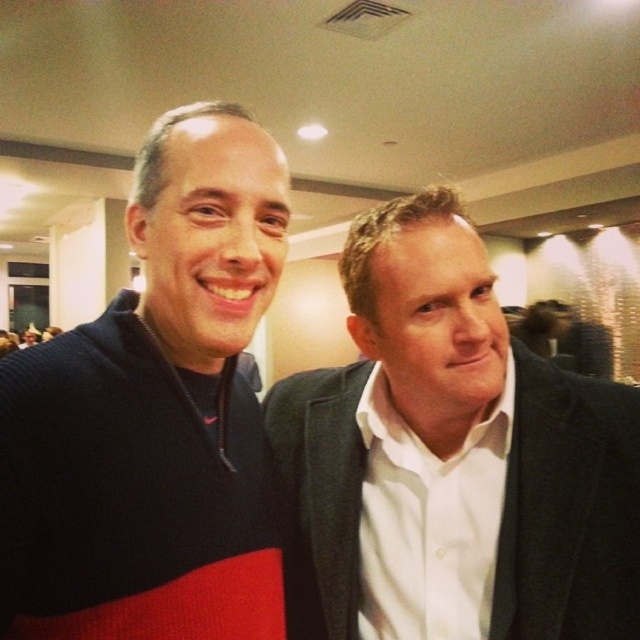
Is white matte suit at center shorter than knit sweater at left?

Yes.

Who is higher up, white matte suit at center or knit sweater at left?

Positioned higher is knit sweater at left.

Between point (368, 621) and point (90, 513), which one is positioned behind?

The point (368, 621) is behind.

Locate an element on the screen. The image size is (640, 640). white matte suit at center is located at coordinates (451, 456).